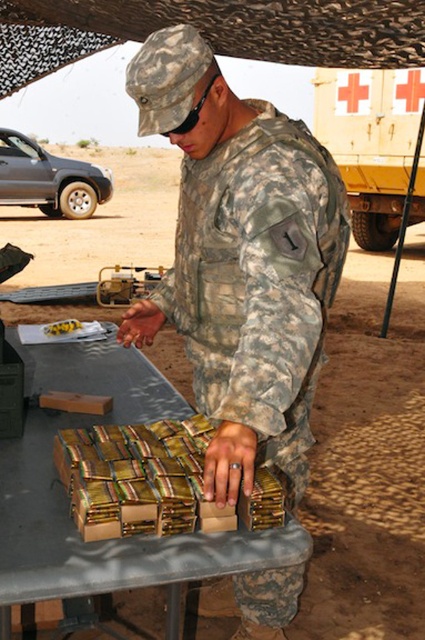
Question: Which point appears farthest from the camera in this image?

Choices:
 (A) (302, 305)
 (B) (27, 529)

Answer: (A)

Question: Does camouflage uniform at center have a smaller size compared to brown cardboard boxes at center?

Choices:
 (A) no
 (B) yes

Answer: (A)

Question: Which of the following is the closest to the observer?

Choices:
 (A) camouflage uniform at center
 (B) brown cardboard boxes at center

Answer: (B)

Question: Is camouflage uniform at center to the right of brown cardboard boxes at center from the viewer's perspective?

Choices:
 (A) yes
 (B) no

Answer: (A)

Question: Does camouflage uniform at center have a lesser width compared to brown cardboard boxes at center?

Choices:
 (A) yes
 (B) no

Answer: (A)